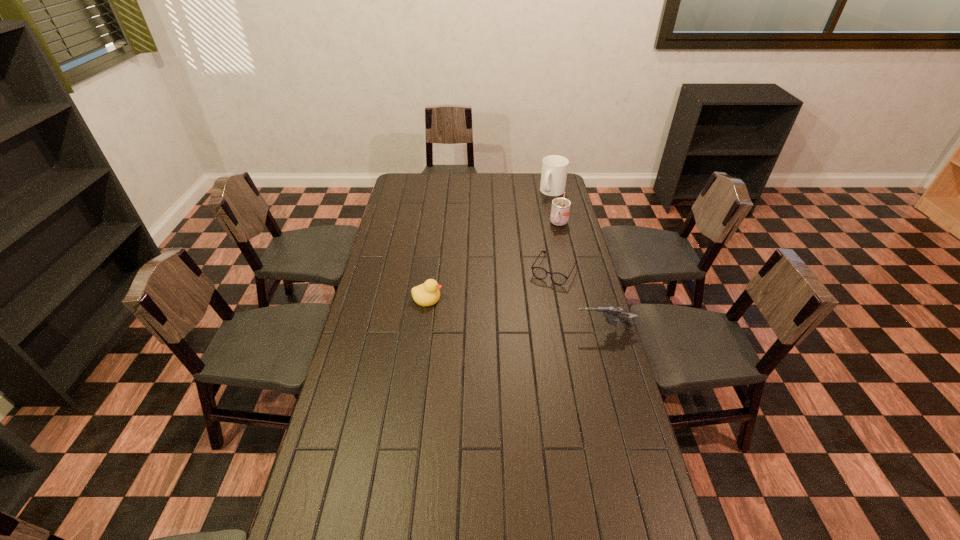
Identify the location of vacant space on the desktop that is between the second shortest object and the gun and is positioned on the front-facing side of the spectacles. The image size is (960, 540). (529, 316).

At what (x,y) coordinates should I click in order to perform the action: click on vacant space on the desktop that is between the fourth farthest object and the gun and is positioned on the side with the handle of the fourth nearest object. Please return your answer as a coordinate pair (x, y). The width and height of the screenshot is (960, 540). Looking at the image, I should click on (513, 313).

Identify the location of vacant space on the desktop that is between the second shortest object and the gun and is positioned on the handle side of the mug. The height and width of the screenshot is (540, 960). (490, 309).